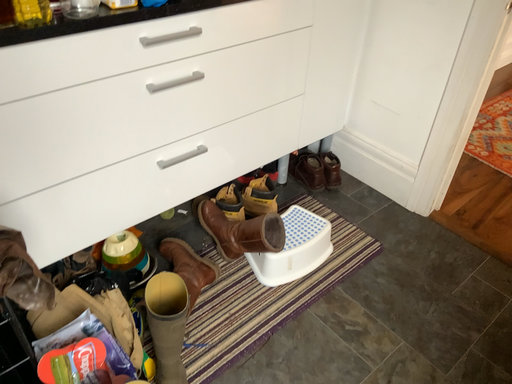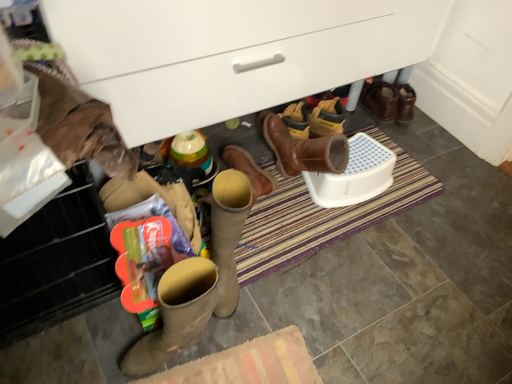
Question: How did the camera likely rotate when shooting the video?

Choices:
 (A) rotated left
 (B) rotated right

Answer: (A)